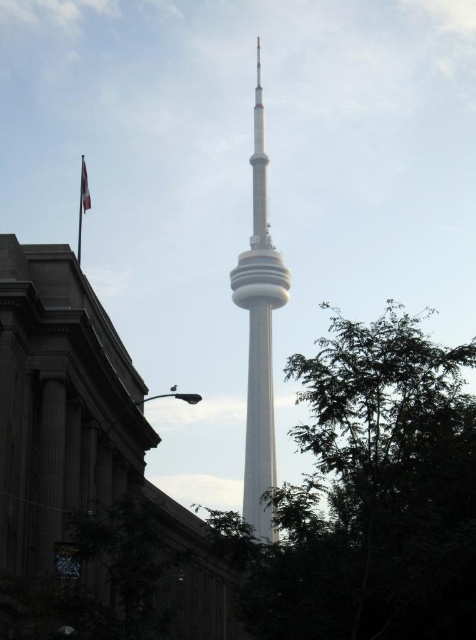
Is white smooth tower at center below red fabric flag at left?

Yes, white smooth tower at center is below red fabric flag at left.

Can you confirm if white smooth tower at center is bigger than red fabric flag at left?

Indeed, white smooth tower at center has a larger size compared to red fabric flag at left.

Between point (255, 141) and point (85, 184), which one is positioned behind?

Point (255, 141)

Find the location of `white smooth tower at center`. white smooth tower at center is located at coordinates point(259,333).

How far apart are green leafy tree at center and red fabric flag at left?

green leafy tree at center and red fabric flag at left are 49.65 meters apart from each other.

Does green leafy tree at center appear over red fabric flag at left?

Actually, green leafy tree at center is below red fabric flag at left.

Locate an element on the screen. This screenshot has width=476, height=640. green leafy tree at center is located at coordinates (368, 493).

What do you see at coordinates (368, 493) in the screenshot? I see `green leafy tree at center` at bounding box center [368, 493].

What do you see at coordinates (368, 493) in the screenshot?
I see `green leafy tree at center` at bounding box center [368, 493].

You are a GUI agent. You are given a task and a screenshot of the screen. Output one action in this format:
    pyautogui.click(x=<x>, y=<y>)
    Task: Click on the green leafy tree at center
    
    Given the screenshot: What is the action you would take?
    pyautogui.click(x=368, y=493)